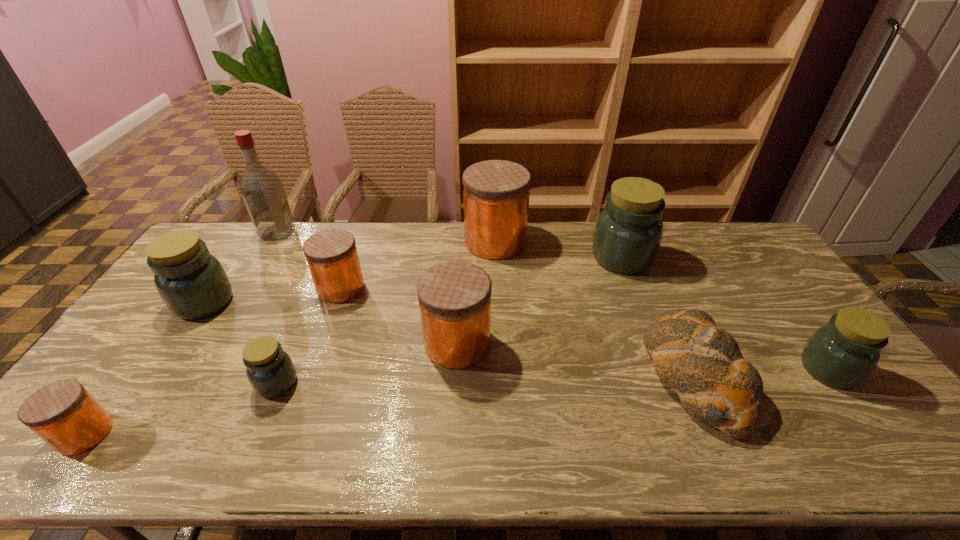
The image size is (960, 540). What are the coordinates of `blank region between the farthest green jar and the second biggest green jar` in the screenshot? It's located at (413, 280).

At what (x,y) coordinates should I click in order to perform the action: click on free space between the liquor and the smallest green jar. Please return your answer as a coordinate pair (x, y). Looking at the image, I should click on (277, 307).

Locate an element on the screen. object that is the third nearest to the rightmost object is located at coordinates (496, 193).

Identify which object is located as the eighth nearest to the third green jar from right to left. Please provide its 2D coordinates. Your answer should be formatted as a tuple, i.e. [(x, y)], where the tuple contains the x and y coordinates of a point satisfying the conditions above.

[(628, 232)]

Identify which jar is located as the third nearest to the leftmost orange jar. Please provide its 2D coordinates. Your answer should be formatted as a tuple, i.e. [(x, y)], where the tuple contains the x and y coordinates of a point satisfying the conditions above.

[(332, 257)]

Find the location of a particular element. The width and height of the screenshot is (960, 540). jar that is the fourth closest to the smallest green jar is located at coordinates (454, 297).

What are the coordinates of `the second closest green jar to the second nearest orange jar` in the screenshot? It's located at click(628, 232).

I want to click on the third closest green jar relative to the rightmost object, so click(x=193, y=284).

Identify which orange jar is located as the nearest to the smallest green jar. Please provide its 2D coordinates. Your answer should be formatted as a tuple, i.e. [(x, y)], where the tuple contains the x and y coordinates of a point satisfying the conditions above.

[(332, 257)]

Identify which orange jar is located as the fourth nearest to the rightmost jar. Please provide its 2D coordinates. Your answer should be formatted as a tuple, i.e. [(x, y)], where the tuple contains the x and y coordinates of a point satisfying the conditions above.

[(65, 415)]